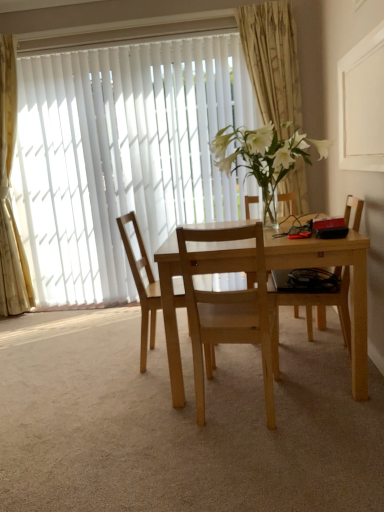
At what (x,y) coordinates should I click in order to perform the action: click on vacant region in front of white sheer curtain at left, the first curtain viewed from the left. Please return your answer as a coordinate pair (x, y). The height and width of the screenshot is (512, 384). Looking at the image, I should click on (27, 323).